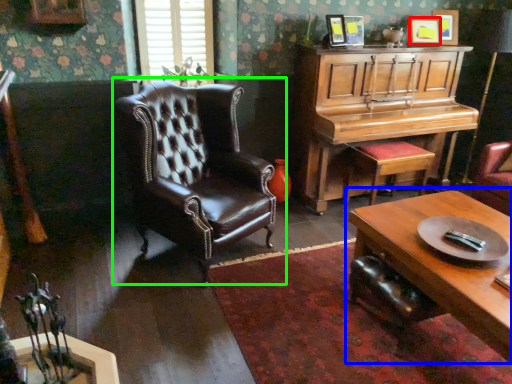
Question: Considering the real-world distances, which object is farthest from picture frame (highlighted by a red box)? coffee table (highlighted by a blue box) or chair (highlighted by a green box)?

Choices:
 (A) coffee table
 (B) chair

Answer: (B)